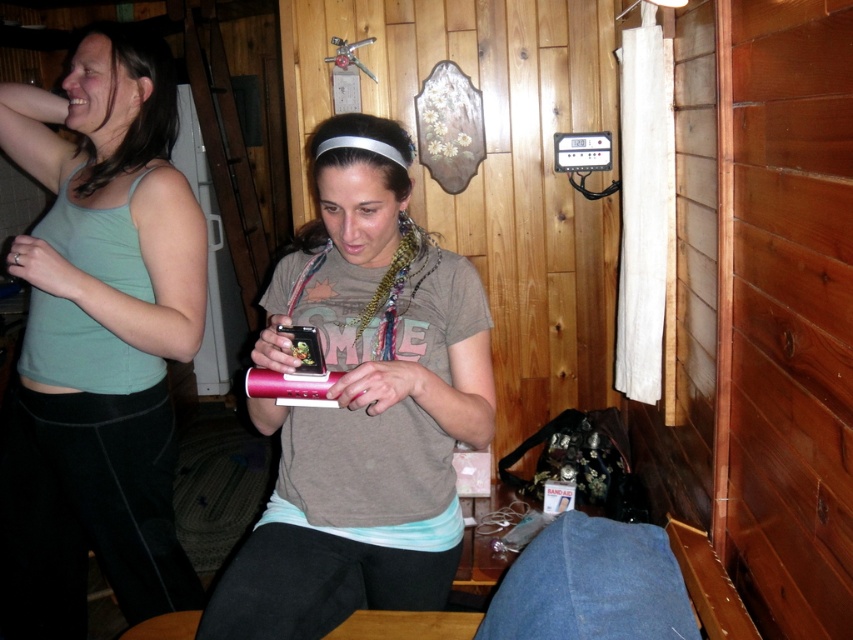
Does matte green tank top at left appear under pink plastic phone at center?

Incorrect, matte green tank top at left is not positioned below pink plastic phone at center.

Who is more distant from viewer, (79, 356) or (480, 428)?

Point (79, 356)

The height and width of the screenshot is (640, 853). Describe the element at coordinates (97, 340) in the screenshot. I see `matte green tank top at left` at that location.

What are the coordinates of `matte green tank top at left` in the screenshot? It's located at (97, 340).